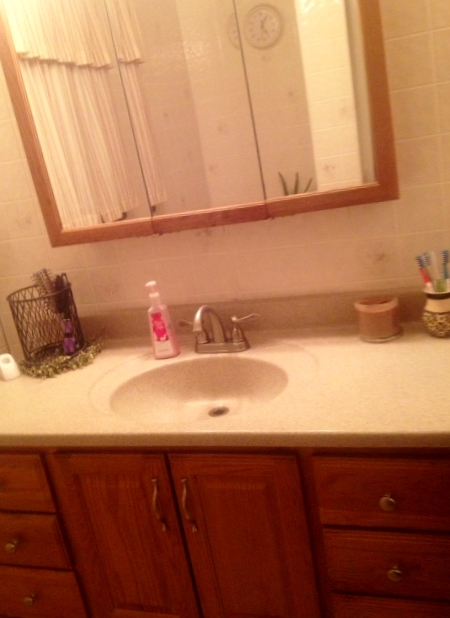
The width and height of the screenshot is (450, 618). I want to click on wooden mirror frame, so [381, 95].